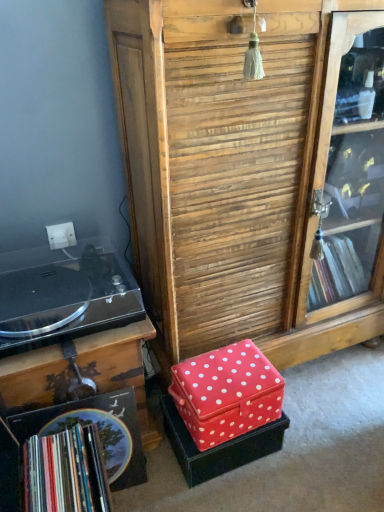
In order to face red fabric box at lower center, which is the 2th storage box in bottom-to-top order, should I rotate leftwards or rightwards?

Rotate your view right by about 4.621°.

Find the location of a particular element. wooden at center is located at coordinates (225, 172).

Which point is more distant from viewer, [272,371] or [34,381]?

The point [272,371] is more distant.

Who is more distant, red fabric box at lower center, which is the 1th storage box from top to bottom, or black plastic record player at left?

red fabric box at lower center, which is the 1th storage box from top to bottom, is further from the camera.

How distant is red fabric box at lower center, which is the 1th storage box from top to bottom, from black plastic record player at left?

24.91 centimeters.

Is red fabric box at lower center, which is the 2th storage box in bottom-to-top order, smaller than black plastic record player at left?

Indeed, red fabric box at lower center, which is the 2th storage box in bottom-to-top order, has a smaller size compared to black plastic record player at left.

Is point (101, 453) closer to camera compared to point (195, 190)?

That is True.

Is wooden at center located within multicolored paper book at lower left?

That's incorrect, wooden at center is not inside multicolored paper book at lower left.

From the picture: From the image's perspective, relative to wooden at center, is multicolored paper book at lower left above or below?

Clearly, from the image's perspective, multicolored paper book at lower left is below wooden at center.

Measure the distance from multicolored paper book at lower left to wooden at center.

multicolored paper book at lower left and wooden at center are 25.44 inches apart from each other.

Could you tell me if multicolored paper book at lower left is turned towards red fabric box at center, the second storage box positioned from the top?

Yes, multicolored paper book at lower left faces towards red fabric box at center, the second storage box positioned from the top.

From the image's perspective, is multicolored paper book at lower left above or below red fabric box at center, the second storage box positioned from the top?

Clearly, from the image's perspective, multicolored paper book at lower left is below red fabric box at center, the second storage box positioned from the top.

Considering the relative sizes of multicolored paper book at lower left and red fabric box at center, the first storage box positioned from the bottom, in the image provided, is multicolored paper book at lower left thinner than red fabric box at center, the first storage box positioned from the bottom,?

Yes, multicolored paper book at lower left is thinner than red fabric box at center, the first storage box positioned from the bottom.

Based on their positions, is multicolored paper book at lower left located to the left or right of red fabric box at center, the second storage box positioned from the top?

From the image, it's evident that multicolored paper book at lower left is to the left of red fabric box at center, the second storage box positioned from the top.

Is red fabric box at center, the first storage box positioned from the bottom, directly adjacent to black plastic record player at left?

red fabric box at center, the first storage box positioned from the bottom, and black plastic record player at left are clearly separated.

Is black plastic record player at left surrounded by red fabric box at center, the first storage box positioned from the bottom?

No, black plastic record player at left is not surrounded by red fabric box at center, the first storage box positioned from the bottom.

Between red fabric box at center, the second storage box positioned from the top, and black plastic record player at left, which one has larger size?

Bigger between the two is black plastic record player at left.

Which object is closer to the camera taking this photo, red fabric box at center, the second storage box positioned from the top, or black plastic record player at left?

black plastic record player at left is in front.

Does black plastic record player at left have a greater height compared to wooden at center?

No, black plastic record player at left is not taller than wooden at center.

Considering the relative positions of black plastic record player at left and wooden at center in the image provided, is black plastic record player at left to the right of wooden at center from the viewer's perspective?

Incorrect, black plastic record player at left is not on the right side of wooden at center.

Is the depth of black plastic record player at left less than that of wooden at center?

No, black plastic record player at left is further to the viewer.

From the picture: Between black plastic record player at left and wooden at center, which one has smaller size?

black plastic record player at left is smaller.

Considering the positions of objects black plastic record player at left and multicolored paper book at lower left in the image provided, who is more to the left, black plastic record player at left or multicolored paper book at lower left?

From the viewer's perspective, black plastic record player at left appears more on the left side.

From the image's perspective, is black plastic record player at left positioned above or below multicolored paper book at lower left?

black plastic record player at left is situated higher than multicolored paper book at lower left in the image.

Does black plastic record player at left lie behind multicolored paper book at lower left?

Yes, black plastic record player at left is further from the viewer.

Who is smaller, black plastic record player at left or multicolored paper book at lower left?

With smaller size is multicolored paper book at lower left.

Does red fabric box at center, the first storage box positioned from the bottom, have a greater height compared to wooden at center?

No.

In the image, is red fabric box at center, the first storage box positioned from the bottom, positioned in front of or behind wooden at center?

Clearly, red fabric box at center, the first storage box positioned from the bottom, is behind wooden at center.

From the image's perspective, is red fabric box at center, the first storage box positioned from the bottom, above or below wooden at center?

Clearly, from the image's perspective, red fabric box at center, the first storage box positioned from the bottom, is below wooden at center.

Image resolution: width=384 pixels, height=512 pixels. What are the coordinates of `storage box that is the 1st one when counting downward from the black plastic record player at left (from the image's perspective)` in the screenshot? It's located at (226, 393).

Identify the location of book beneath the wooden at center (from a real-world perspective). This screenshot has height=512, width=384. (66, 472).

Estimate the real-world distances between objects in this image. Which object is further from red fabric box at center, the first storage box positioned from the bottom, black plastic record player at left or red fabric box at lower center, which is the 1th storage box from top to bottom?

Among the two, black plastic record player at left is located further to red fabric box at center, the first storage box positioned from the bottom.

From the image, which object appears to be nearer to multicolored paper book at lower left, black plastic record player at left or red fabric box at lower center, which is the 2th storage box in bottom-to-top order?

black plastic record player at left is closer to multicolored paper book at lower left.

From the picture: From the image, which object appears to be farther from red fabric box at lower center, which is the 2th storage box in bottom-to-top order, black plastic record player at left or wooden at center?

wooden at center is positioned further to the anchor red fabric box at lower center, which is the 2th storage box in bottom-to-top order.

Looking at the image, which one is located further to multicolored paper book at lower left, wooden at center or black plastic record player at left?

wooden at center is positioned further to the anchor multicolored paper book at lower left.

Looking at the image, which one is located further to red fabric box at center, the second storage box positioned from the top, red fabric box at lower center, which is the 1th storage box from top to bottom, or multicolored paper book at lower left?

multicolored paper book at lower left.

From the image, which object appears to be farther from black plastic record player at left, multicolored paper book at lower left or red fabric box at lower center, which is the 2th storage box in bottom-to-top order?

red fabric box at lower center, which is the 2th storage box in bottom-to-top order.

Consider the image. Which object lies nearer to the anchor point wooden at center, black plastic record player at left or red fabric box at center, the second storage box positioned from the top?

The object closer to wooden at center is black plastic record player at left.

When comparing their distances from red fabric box at lower center, which is the 1th storage box from top to bottom, does multicolored paper book at lower left or wooden at center seem further?

Among the two, multicolored paper book at lower left is located further to red fabric box at lower center, which is the 1th storage box from top to bottom.

The width and height of the screenshot is (384, 512). Identify the location of table between wooden at center and multicolored paper book at lower left in the up-down direction. (120, 367).

Find the location of a particular element. This screenshot has width=384, height=512. storage box between multicolored paper book at lower left and red fabric box at center, the second storage box positioned from the top, from left to right is located at coordinates (226, 393).

Identify the location of table between wooden at center and red fabric box at center, the second storage box positioned from the top, vertically. The image size is (384, 512). (120, 367).

In order to click on storage box between black plastic record player at left and red fabric box at center, the second storage box positioned from the top, from left to right in this screenshot , I will do `click(226, 393)`.